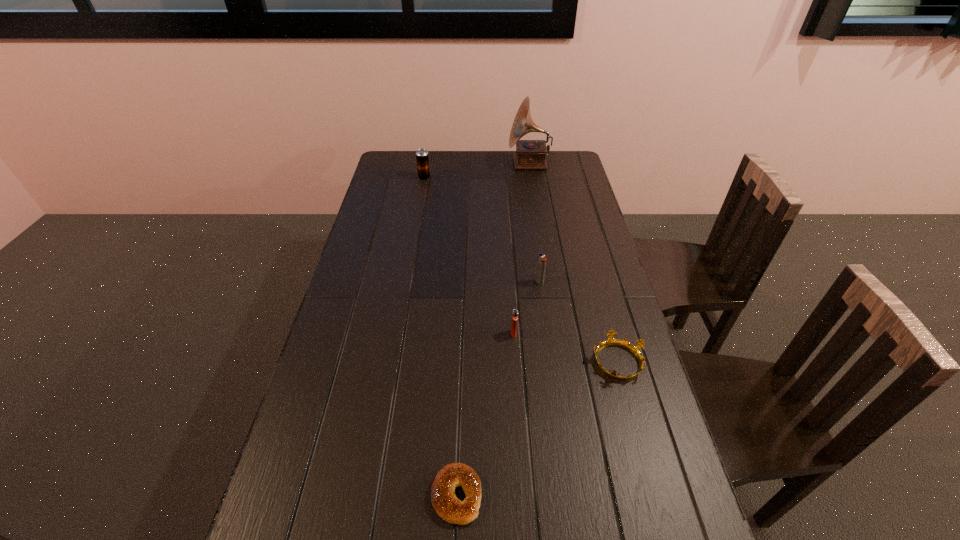
I want to click on the tallest object, so click(x=530, y=154).

Locate an element on the screen. The width and height of the screenshot is (960, 540). beer can is located at coordinates (422, 157).

You are a GUI agent. You are given a task and a screenshot of the screen. Output one action in this format:
    pyautogui.click(x=<x>, y=<y>)
    Task: Click on the right igniter
    
    Given the screenshot: What is the action you would take?
    pyautogui.click(x=541, y=261)

The height and width of the screenshot is (540, 960). I want to click on the fourth nearest object, so click(541, 261).

This screenshot has height=540, width=960. Find the location of `the left igniter`. the left igniter is located at coordinates (515, 312).

Where is `the fourth farthest object`? the fourth farthest object is located at coordinates (515, 312).

Where is `crown`? crown is located at coordinates (635, 350).

You are a GUI agent. You are given a task and a screenshot of the screen. Output one action in this format:
    pyautogui.click(x=<x>, y=<y>)
    Task: Click on the fifth tallest object
    This screenshot has height=540, width=960.
    Given the screenshot: What is the action you would take?
    pyautogui.click(x=635, y=350)

This screenshot has height=540, width=960. I want to click on the nearest object, so click(x=444, y=501).

Find the location of a particular element. The image size is (960, 540). the second object from left to right is located at coordinates (444, 501).